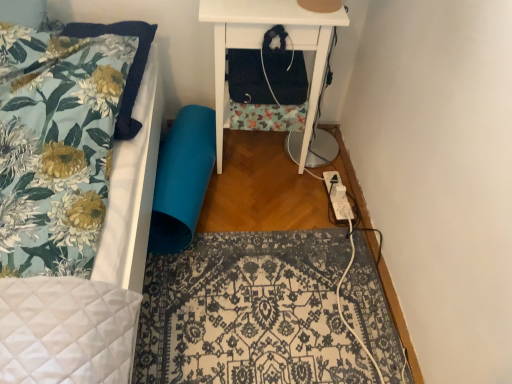
Locate an element on the screen. vacant area on the back side of white plastic extension cord at lower right is located at coordinates tap(329, 172).